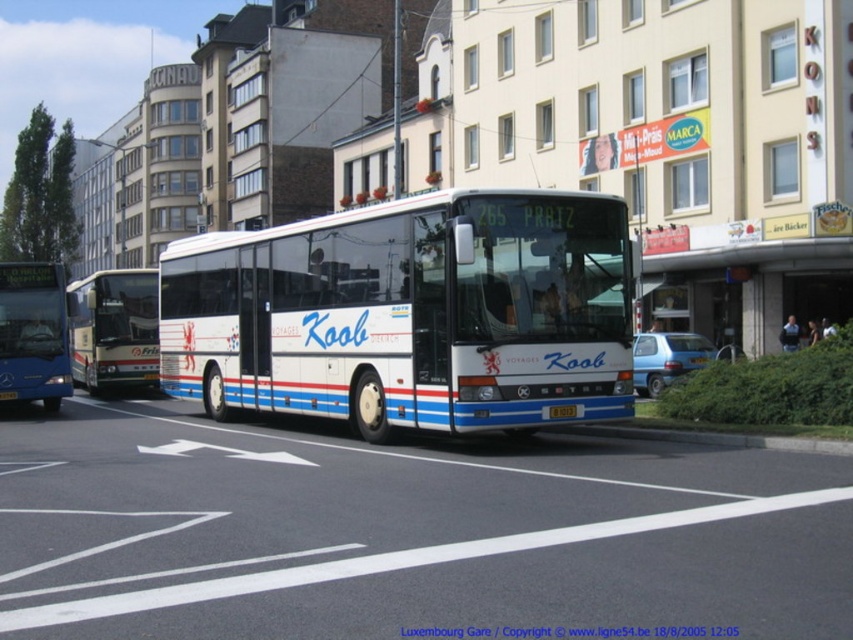
Is point (102, 385) more distant than point (18, 353)?

Yes.

Does matte silver bus at left have a greater height compared to blue metallic bus at left?

Indeed, matte silver bus at left has a greater height compared to blue metallic bus at left.

Which is in front, point (119, 317) or point (38, 371)?

Point (38, 371) is more forward.

Image resolution: width=853 pixels, height=640 pixels. I want to click on matte silver bus at left, so click(114, 330).

Is matte silver bus at left taller than yellow metallic license plate at center?

Yes.

From the picture: Can you confirm if matte silver bus at left is positioned to the right of yellow metallic license plate at center?

No, matte silver bus at left is not to the right of yellow metallic license plate at center.

Locate an element on the screen. The image size is (853, 640). matte silver bus at left is located at coordinates (114, 330).

Can you confirm if white glossy bus at center is wider than blue metallic bus at left?

Yes.

Between white glossy bus at center and blue metallic bus at left, which one is positioned lower?

Positioned lower is white glossy bus at center.

The image size is (853, 640). What do you see at coordinates (409, 314) in the screenshot?
I see `white glossy bus at center` at bounding box center [409, 314].

This screenshot has width=853, height=640. I want to click on white glossy bus at center, so click(409, 314).